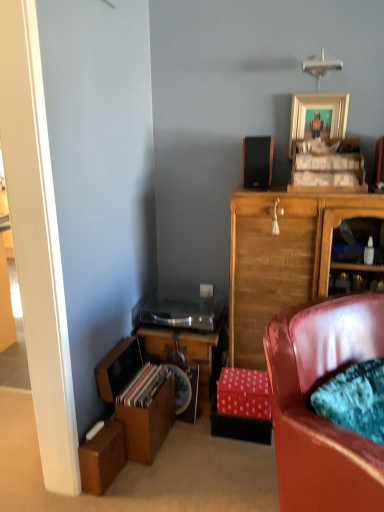
In order to click on free location above pink polka dot cardboard box at lower center, which is the 1th cardboard box from back to front (from a real-world perspective) in this screenshot , I will do `click(245, 382)`.